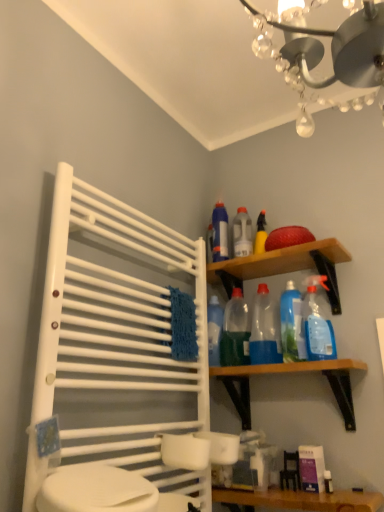
Locate an element on the screen. The image size is (384, 512). free spot behind translucent plastic bottle at upper center, the 1th bottle in the back-to-front sequence is located at coordinates (242, 270).